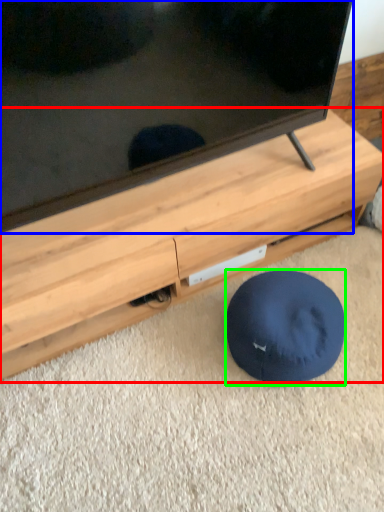
Question: Which object is the closest to the furniture (highlighted by a red box)? Choose among these: television (highlighted by a blue box) or dog bed (highlighted by a green box).

Choices:
 (A) television
 (B) dog bed

Answer: (A)